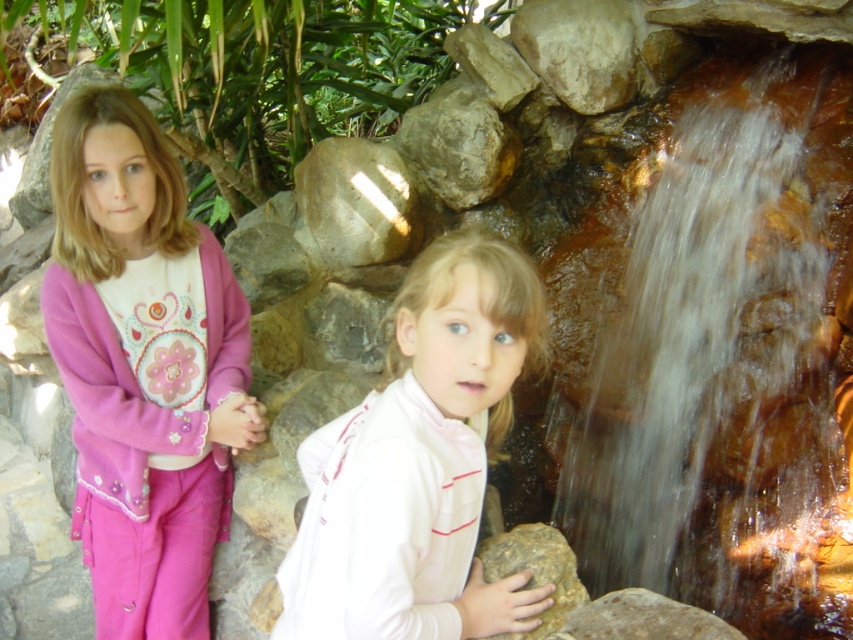
How much distance is there between translucent wet rock at right and rocky brown rock at lower right?

translucent wet rock at right and rocky brown rock at lower right are 4.32 feet apart.

Can you confirm if translucent wet rock at right is wider than rocky brown rock at lower right?

Correct, the width of translucent wet rock at right exceeds that of rocky brown rock at lower right.

Where is `translucent wet rock at right`? This screenshot has height=640, width=853. translucent wet rock at right is located at coordinates (712, 348).

Describe the element at coordinates (419, 461) in the screenshot. I see `white matte jacket at center` at that location.

Between white matte jacket at center and rocky brown rock at lower right, which one is positioned higher?

white matte jacket at center is above.

Which is behind, point (390, 436) or point (495, 563)?

The point (495, 563) is more distant.

The width and height of the screenshot is (853, 640). I want to click on white matte jacket at center, so click(x=419, y=461).

Does point (744, 170) come in front of point (321, 506)?

No.

Is translucent wet rock at right positioned behind white matte jacket at center?

Yes, translucent wet rock at right is further from the viewer.

Does point (729, 384) come behind point (454, 484)?

Yes, point (729, 384) is farther from viewer.

Find the location of a particular element. This screenshot has width=853, height=640. translucent wet rock at right is located at coordinates (712, 348).